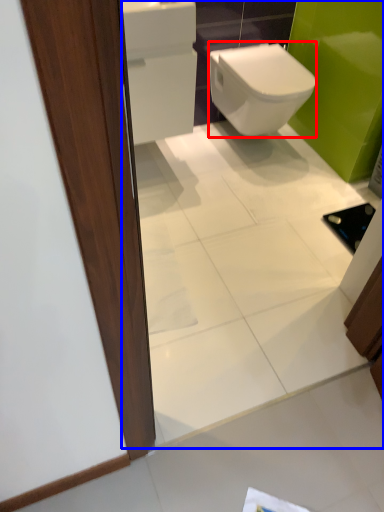
Question: Which object appears farthest to the camera in this image, bidet (highlighted by a red box) or mirror (highlighted by a blue box)?

Choices:
 (A) bidet
 (B) mirror

Answer: (A)